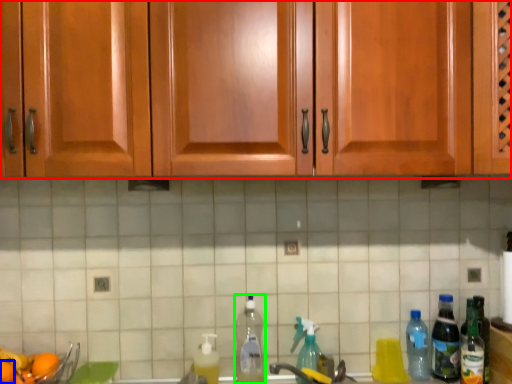
Question: Based on their relative distances, which object is farther from cabinetry (highlighted by a red box)? Choose from orange (highlighted by a blue box) and bottle (highlighted by a green box).

Choices:
 (A) orange
 (B) bottle

Answer: (A)